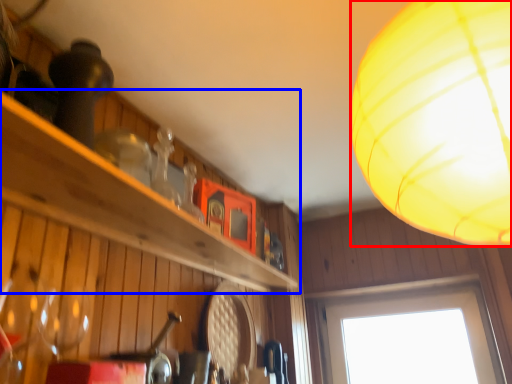
Question: Which object appears closest to the camera in this image, lamp (highlighted by a red box) or shelf (highlighted by a blue box)?

Choices:
 (A) lamp
 (B) shelf

Answer: (A)